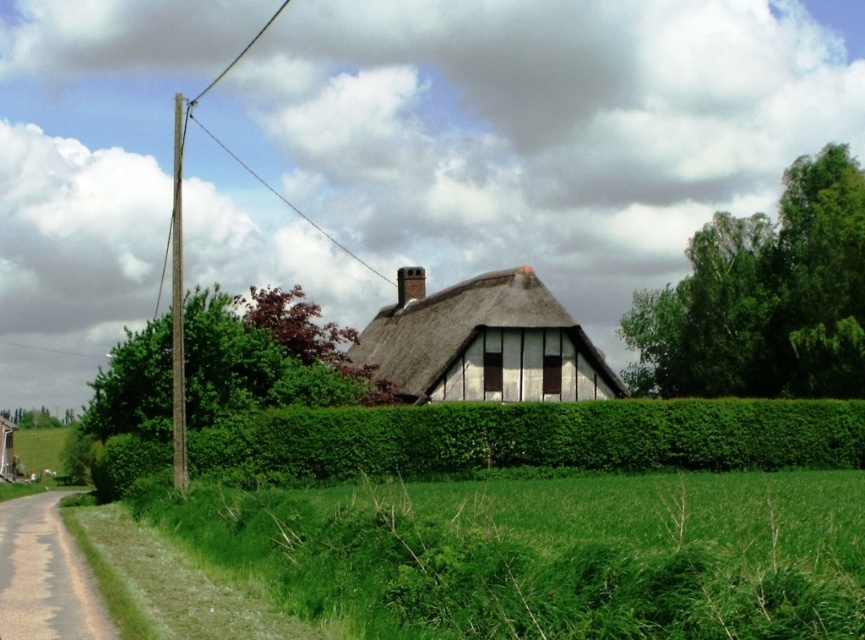
Question: Can you confirm if green grass at lower left is positioned to the right of green leafy hedge at center?

Choices:
 (A) yes
 (B) no

Answer: (A)

Question: Estimate the real-world distances between objects in this image. Which object is farther from the thatched roof at center?

Choices:
 (A) green grass at lower left
 (B) green leafy hedge at center

Answer: (A)

Question: Which point is farther to the camera?

Choices:
 (A) (335, 476)
 (B) (767, 477)
 (C) (542, 310)

Answer: (C)

Question: Does green grass at lower left have a larger size compared to green leafy hedge at center?

Choices:
 (A) no
 (B) yes

Answer: (B)

Question: Where is green grass at lower left located in relation to green leafy hedge at center in the image?

Choices:
 (A) below
 (B) above

Answer: (B)

Question: Among these points, which one is nearest to the camera?

Choices:
 (A) (638, 632)
 (B) (401, 333)

Answer: (A)